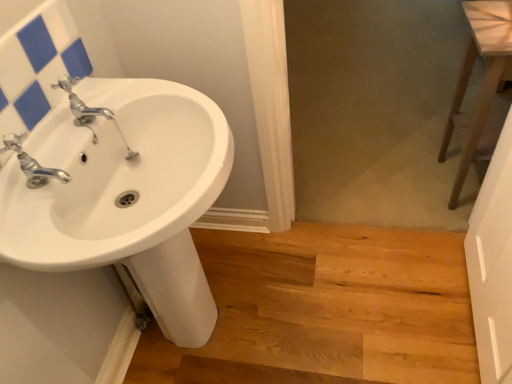
Question: Is white glossy sink at left at the left side of brown wooden stool at right?

Choices:
 (A) no
 (B) yes

Answer: (B)

Question: Considering the relative sizes of white glossy sink at left and brown wooden stool at right in the image provided, is white glossy sink at left thinner than brown wooden stool at right?

Choices:
 (A) yes
 (B) no

Answer: (B)

Question: From the image's perspective, is white glossy sink at left beneath brown wooden stool at right?

Choices:
 (A) yes
 (B) no

Answer: (A)

Question: Is white glossy sink at left shorter than brown wooden stool at right?

Choices:
 (A) yes
 (B) no

Answer: (B)

Question: Is white glossy sink at left closer to the viewer compared to brown wooden stool at right?

Choices:
 (A) yes
 (B) no

Answer: (A)

Question: From the image's perspective, is chrome metallic faucet at upper left above or below brown wooden stool at right?

Choices:
 (A) below
 (B) above

Answer: (A)

Question: Is chrome metallic faucet at upper left bigger or smaller than brown wooden stool at right?

Choices:
 (A) big
 (B) small

Answer: (B)

Question: Choose the correct answer: Is chrome metallic faucet at upper left inside brown wooden stool at right or outside it?

Choices:
 (A) inside
 (B) outside

Answer: (B)

Question: From a real-world perspective, is chrome metallic faucet at upper left physically located above or below brown wooden stool at right?

Choices:
 (A) below
 (B) above

Answer: (B)

Question: In terms of width, does white glossy sink at left look wider or thinner when compared to light brown wood at lower center?

Choices:
 (A) thin
 (B) wide

Answer: (A)

Question: Is white glossy sink at left bigger or smaller than light brown wood at lower center?

Choices:
 (A) small
 (B) big

Answer: (B)

Question: From the image's perspective, is white glossy sink at left above or below light brown wood at lower center?

Choices:
 (A) above
 (B) below

Answer: (A)

Question: In the image, is white glossy sink at left positioned in front of or behind light brown wood at lower center?

Choices:
 (A) behind
 (B) front

Answer: (B)

Question: Is silver metallic faucet at left bigger or smaller than light brown wood at lower center?

Choices:
 (A) small
 (B) big

Answer: (A)

Question: From a real-world perspective, is silver metallic faucet at left positioned above or below light brown wood at lower center?

Choices:
 (A) above
 (B) below

Answer: (A)